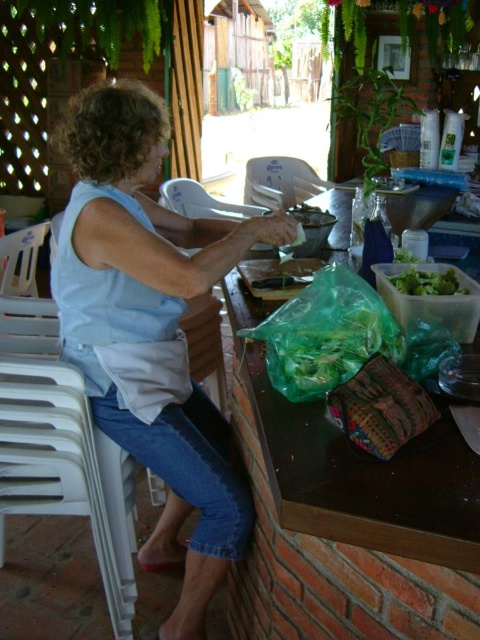
Who is lower down, light blue fabric at center or green leafy salad at center?

light blue fabric at center is lower down.

Can you confirm if light blue fabric at center is thinner than green leafy salad at center?

No, light blue fabric at center is not thinner than green leafy salad at center.

Is point (151, 208) less distant than point (411, 275)?

That is False.

This screenshot has width=480, height=640. I want to click on light blue fabric at center, so click(151, 330).

Between light blue fabric at center and transparent plastic bag at center, which one is positioned lower?

transparent plastic bag at center

Between point (180, 483) and point (385, 618), which one is positioned behind?

The point (180, 483) is behind.

Is point (192, 552) in front of point (266, 620)?

No, (192, 552) is further to viewer.

This screenshot has height=640, width=480. Identify the location of light blue fabric at center. (151, 330).

Which is more to the right, transparent plastic bag at center or green leafy salad at center?

From the viewer's perspective, green leafy salad at center appears more on the right side.

Does transparent plastic bag at center have a lesser height compared to green leafy salad at center?

No, transparent plastic bag at center is not shorter than green leafy salad at center.

Is point (375, 500) more distant than point (414, 285)?

No, it is not.

At what (x,y) coordinates should I click in order to perform the action: click on transparent plastic bag at center. Please return your answer as a coordinate pair (x, y). This screenshot has height=640, width=480. Looking at the image, I should click on (347, 518).